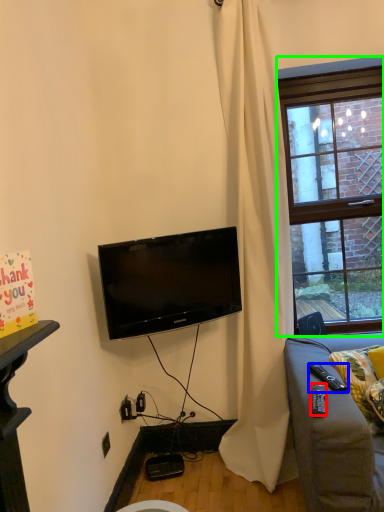
Question: Based on their relative distances, which object is farther from remote control (highlighted by a red box)? Choose from remote control (highlighted by a blue box) and window (highlighted by a green box).

Choices:
 (A) remote control
 (B) window

Answer: (B)